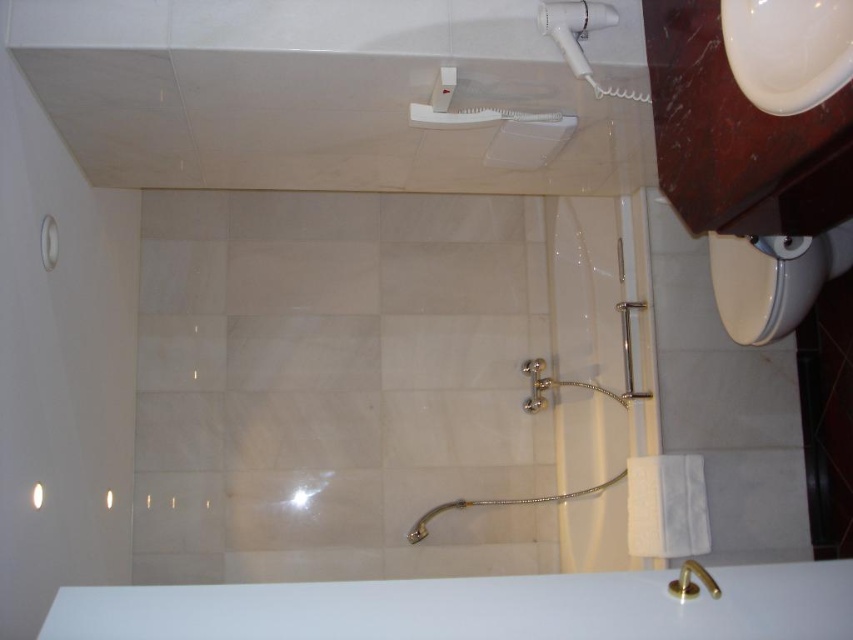
Question: Among these points, which one is nearest to the camera?

Choices:
 (A) (779, 243)
 (B) (271, 593)
 (C) (412, 118)

Answer: (B)

Question: Which point appears farthest from the camera in this image?

Choices:
 (A) tap(703, 577)
 (B) tap(762, 72)
 (C) tap(556, 116)
 (D) tap(790, 252)

Answer: (C)

Question: Is white plastic hairdryer at upper right positioned in front of gold metallic faucet at lower center?

Choices:
 (A) yes
 (B) no

Answer: (B)

Question: Can you confirm if white plastic shower head at upper center is bigger than gold metallic faucet at lower center?

Choices:
 (A) no
 (B) yes

Answer: (B)

Question: Among these objects, which one is farthest from the camera?

Choices:
 (A) gold metallic faucet at lower center
 (B) white glossy bath at lower center

Answer: (A)

Question: In this image, where is white glossy sink at upper right located relative to white plastic shower head at upper center?

Choices:
 (A) right
 (B) left

Answer: (A)